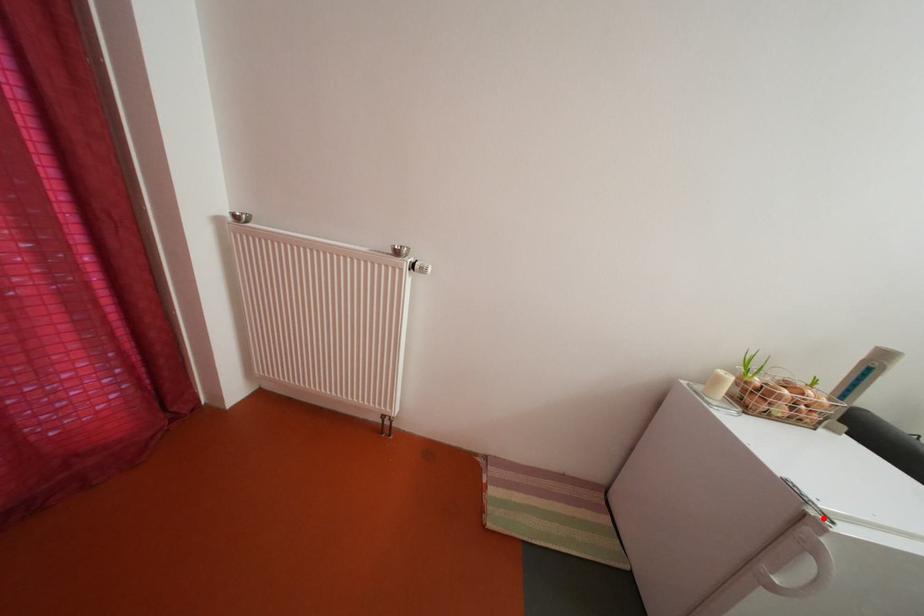
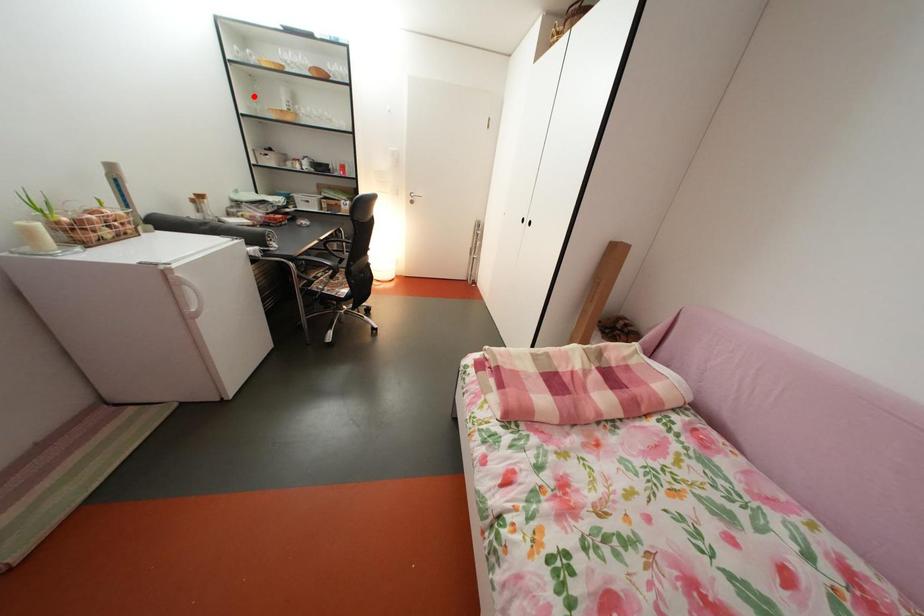
I am providing you with two images of the same scene from different viewpoints. A red point is marked on the first image and another point is marked on the second image. Do the highlighted points in image1 and image2 indicate the same real-world spot?

No